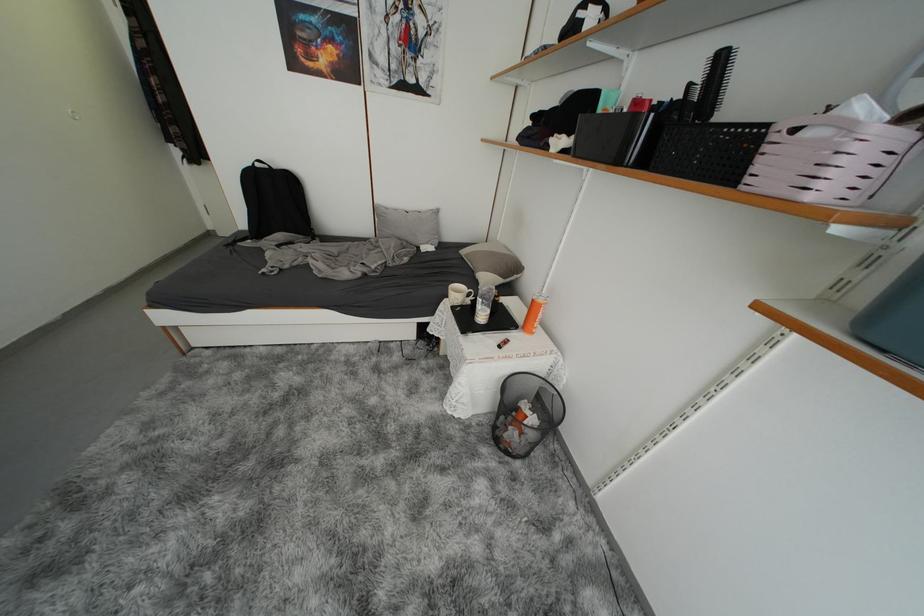
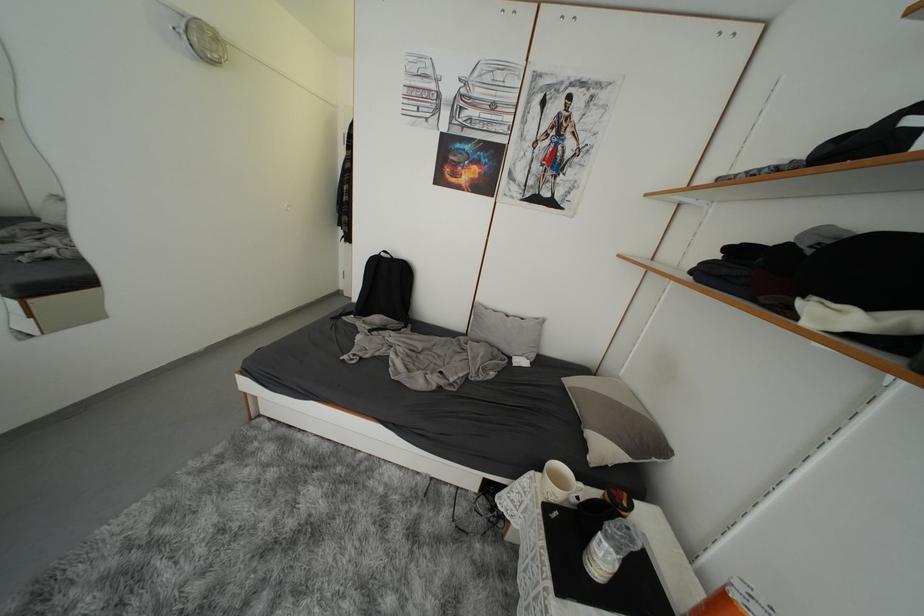
In the second image, find the point that corresponds to (493,283) in the first image.

(610, 453)